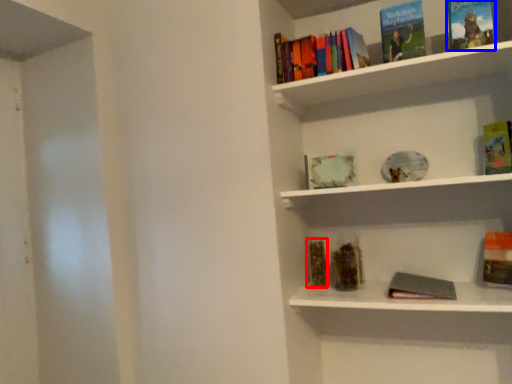
Question: Which point is closer to the camera, book (highlighted by a red box) or book (highlighted by a blue box)?

Choices:
 (A) book
 (B) book

Answer: (B)